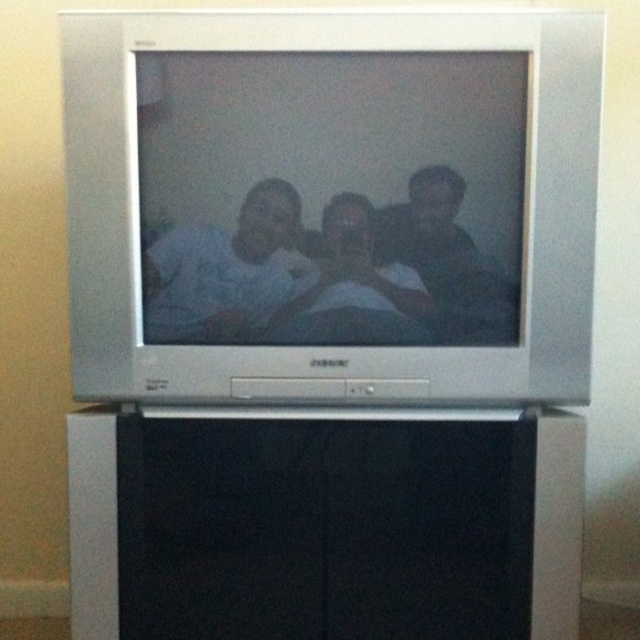
Question: Can you confirm if silver metallic flat at center is thinner than white matte shirt at center?

Choices:
 (A) no
 (B) yes

Answer: (A)

Question: Which point appears closest to the camera in this image?

Choices:
 (A) (205, 307)
 (B) (360, 224)
 (C) (564, 628)
 (D) (234, 68)

Answer: (D)

Question: Which point is closer to the camera?

Choices:
 (A) white matte shirt at center
 (B) matte white shirt at center

Answer: (A)

Question: Estimate the real-world distances between objects in this image. Which object is farther from the white matte shirt at center?

Choices:
 (A) black matte cabinet at lower center
 (B) silver metallic flat at center
 (C) matte white shirt at center

Answer: (A)

Question: Can you confirm if white matte shirt at center is positioned above matte white shirt at center?

Choices:
 (A) no
 (B) yes

Answer: (A)

Question: Can you confirm if silver metallic flat at center is positioned to the right of black matte cabinet at lower center?

Choices:
 (A) yes
 (B) no

Answer: (A)